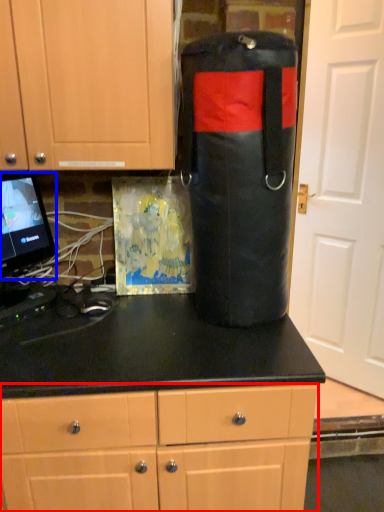
Question: Which object appears closest to the camera in this image, cabinetry (highlighted by a red box) or computer monitor (highlighted by a blue box)?

Choices:
 (A) cabinetry
 (B) computer monitor

Answer: (A)